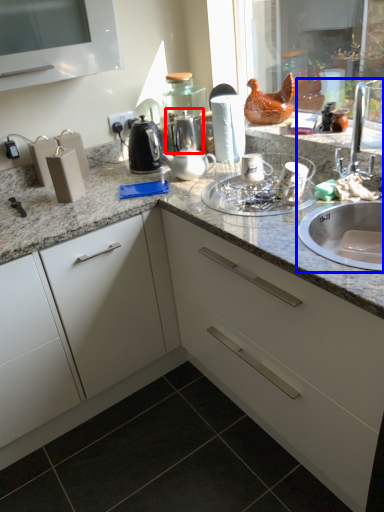
Question: Which of the following is the farthest to the observer, tea pot (highlighted by a red box) or sink (highlighted by a blue box)?

Choices:
 (A) tea pot
 (B) sink

Answer: (A)